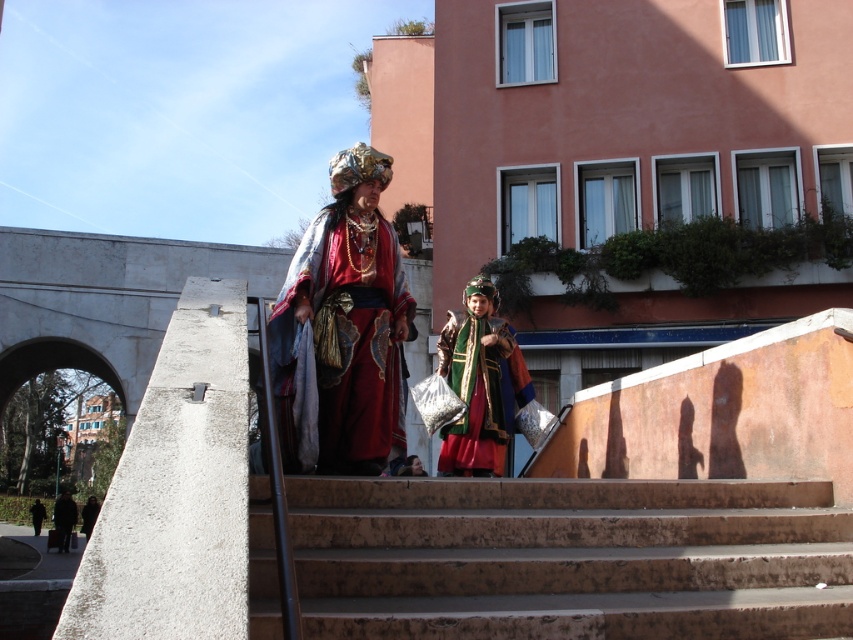
Question: Can you confirm if brown concrete stairs at center is positioned above velvet green coat at center?

Choices:
 (A) no
 (B) yes

Answer: (A)

Question: Is velvet red robe at center wider than velvet green coat at center?

Choices:
 (A) no
 (B) yes

Answer: (A)

Question: From the image, what is the correct spatial relationship of brown concrete stairs at center in relation to velvet red robe at center?

Choices:
 (A) left
 (B) right

Answer: (B)

Question: Which of the following is the farthest from the observer?

Choices:
 (A) velvet red robe at center
 (B) velvet green coat at center

Answer: (B)

Question: Which point is farther to the camera?

Choices:
 (A) velvet red robe at center
 (B) velvet green coat at center

Answer: (B)

Question: Which object is the farthest from the velvet green coat at center?

Choices:
 (A) velvet red robe at center
 (B) brown concrete stairs at center

Answer: (B)